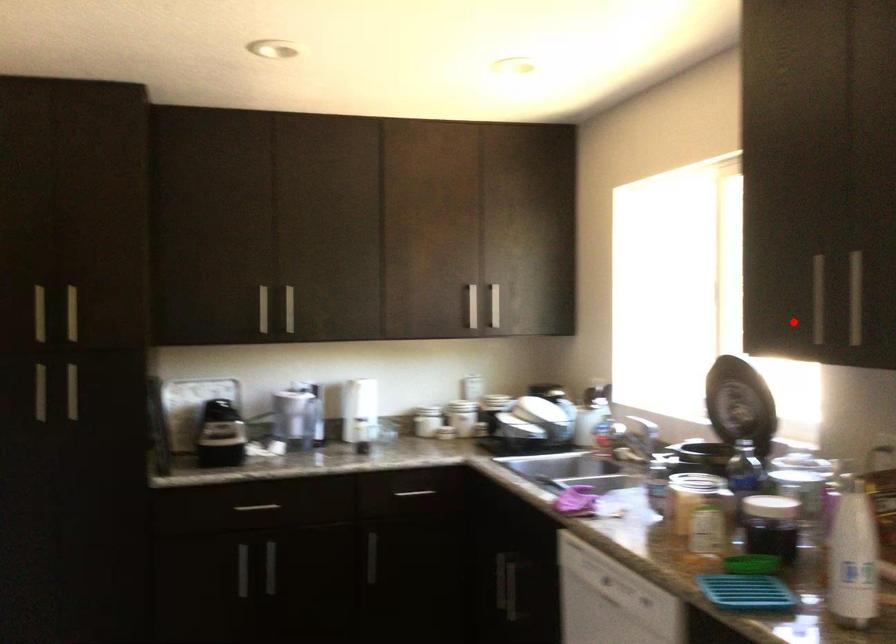
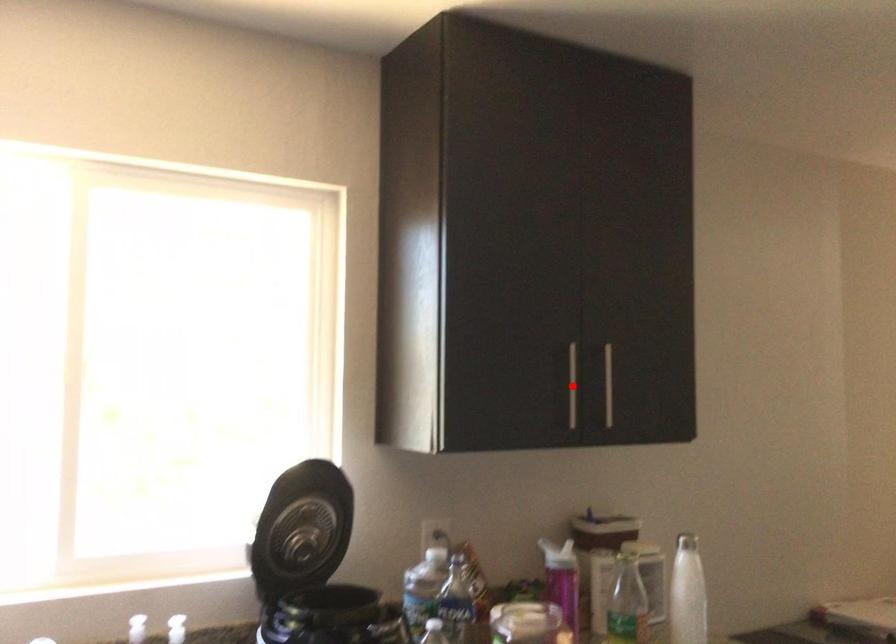
I am providing you with two images of the same scene from different viewpoints. A red point is marked on the first image and another point is marked on the second image. Does the point marked in image1 correspond to the same location as the one in image2?

Yes